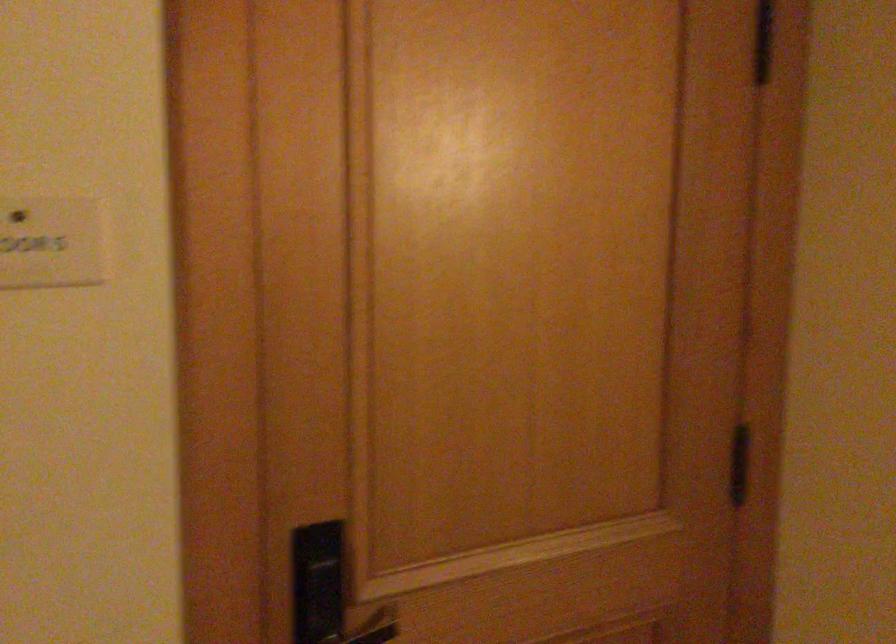
Find where to push the door handle. Please return your answer as a coordinate pair (x, y).

(319, 581)